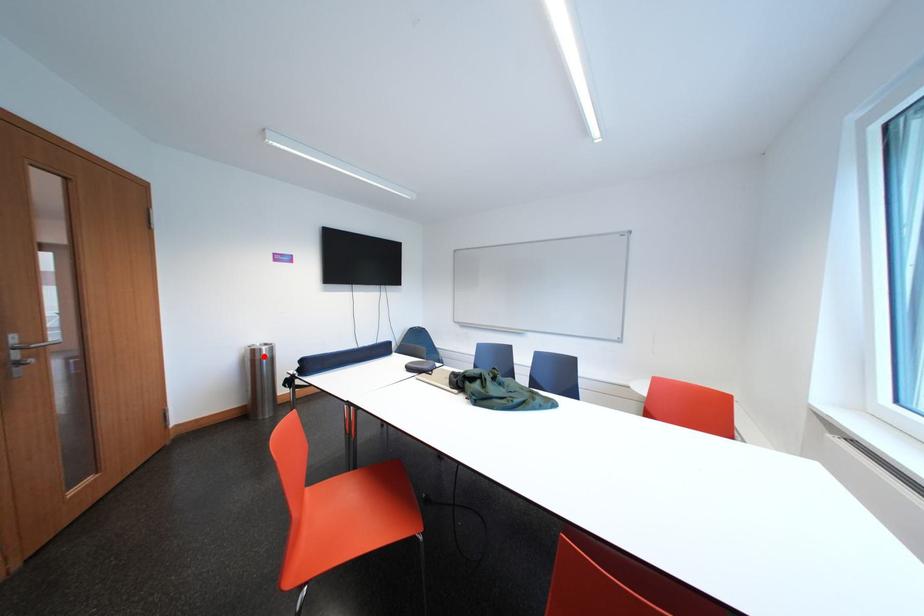
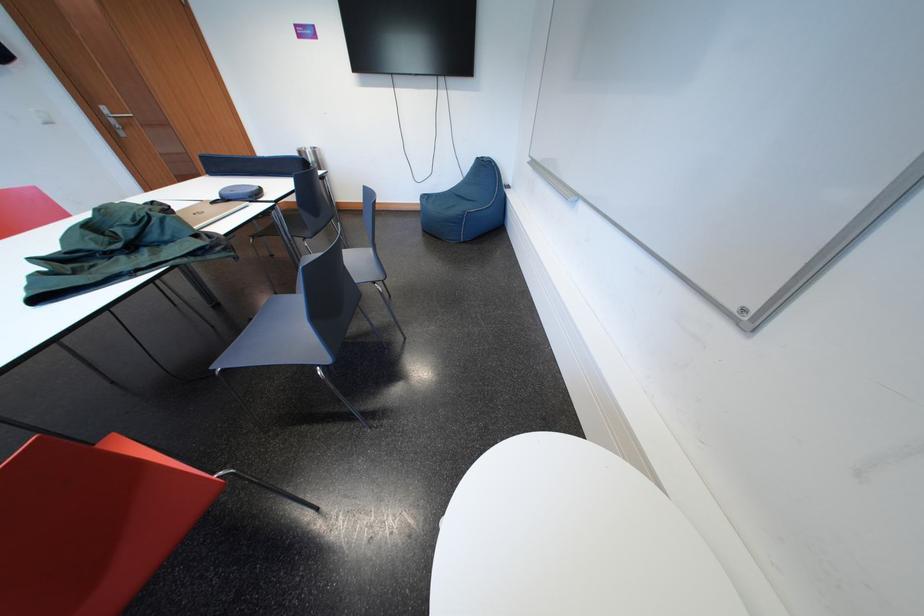
Where in the second image is the point corresponding to the highlighted location from the first image?

(309, 158)